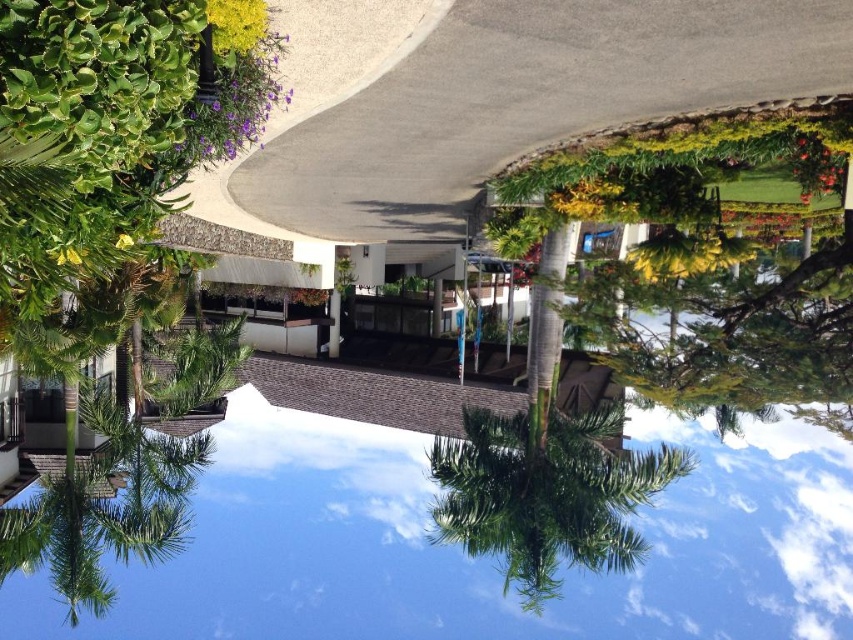
Who is more distant from viewer, (798,513) or (604,438)?

The point (798,513) is more distant.

The height and width of the screenshot is (640, 853). Identify the location of transparent glass pool at center. (469, 560).

The height and width of the screenshot is (640, 853). I want to click on transparent glass pool at center, so click(469, 560).